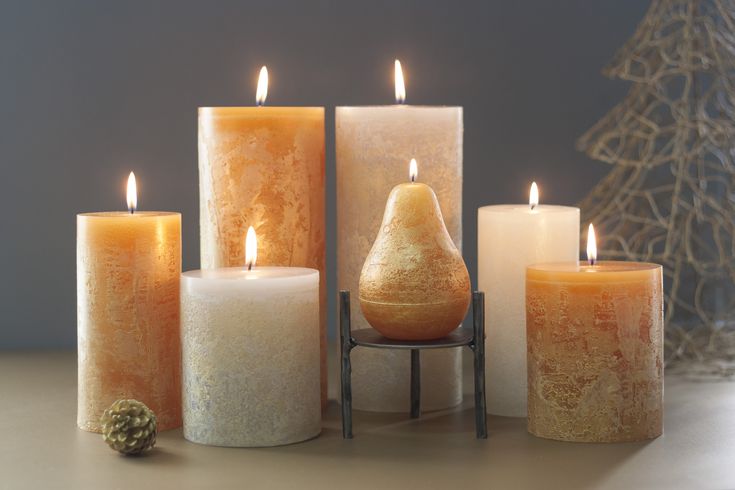
Find the location of a particular element. This screenshot has height=490, width=735. flames on candle is located at coordinates (129, 198), (262, 88), (397, 78), (404, 169), (247, 251), (531, 194), (595, 253).